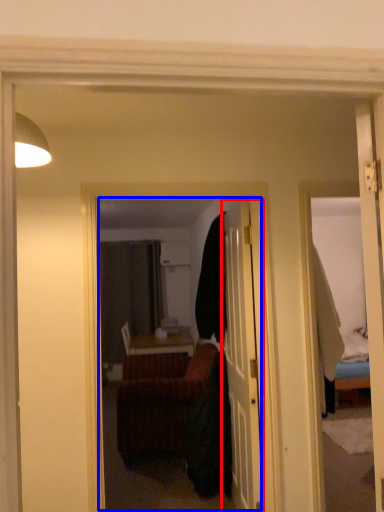
Question: Which of the following is the farthest to the observer, door (highlighted by a red box) or mirror (highlighted by a blue box)?

Choices:
 (A) door
 (B) mirror

Answer: (A)